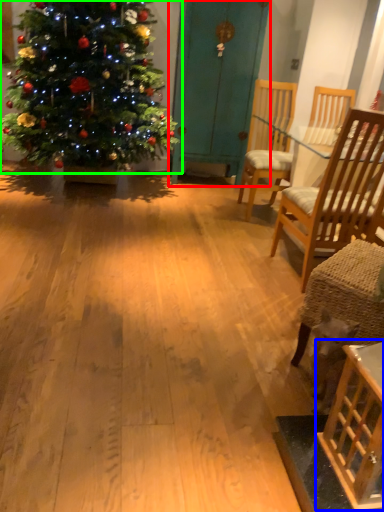
Question: Considering the real-world distances, which object is farthest from armoire (highlighted by a red box)? table (highlighted by a blue box) or christmas tree (highlighted by a green box)?

Choices:
 (A) table
 (B) christmas tree

Answer: (A)